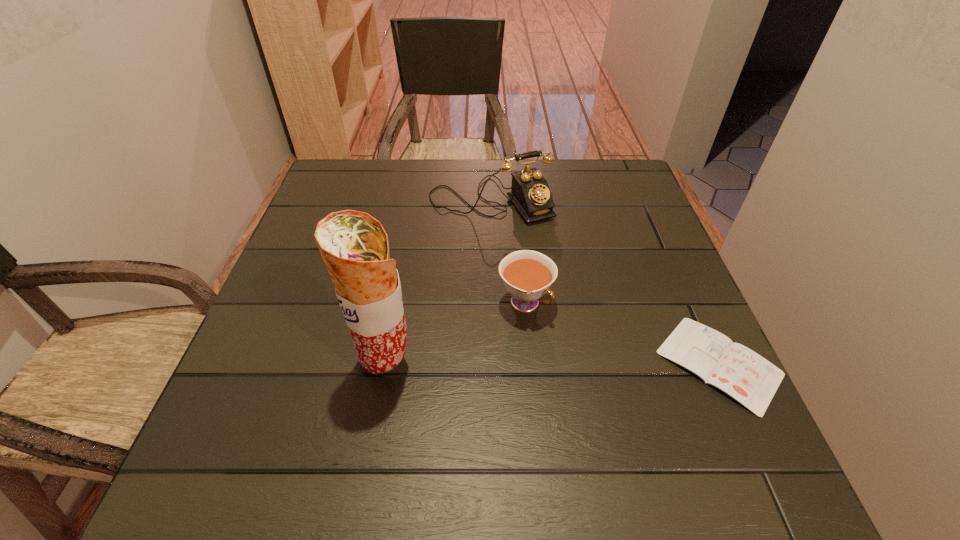
In the image, there is a desktop. What are the coordinates of `blank space at the right edge` in the screenshot? It's located at [660, 300].

Find the location of a particular element. The width and height of the screenshot is (960, 540). vacant space at the near left corner is located at coordinates (262, 402).

I want to click on vacant area at the far right corner of the desktop, so click(585, 180).

Identify the location of free space between the farthest object and the burrito. The width and height of the screenshot is (960, 540). (439, 281).

At what (x,y) coordinates should I click in order to perform the action: click on free space between the third tallest object and the tallest object. Please return your answer as a coordinate pair (x, y). Looking at the image, I should click on (456, 333).

The height and width of the screenshot is (540, 960). Identify the location of free space between the telephone and the teacup. (508, 252).

Where is `vacant space that is in between the tallest object and the second tallest object`? The height and width of the screenshot is (540, 960). vacant space that is in between the tallest object and the second tallest object is located at coordinates (439, 281).

The image size is (960, 540). I want to click on vacant space that is in between the rightmost object and the telephone, so click(x=605, y=282).

Locate an element on the screen. free space between the tallest object and the second shortest object is located at coordinates (456, 333).

I want to click on unoccupied area between the shortest object and the farthest object, so click(605, 282).